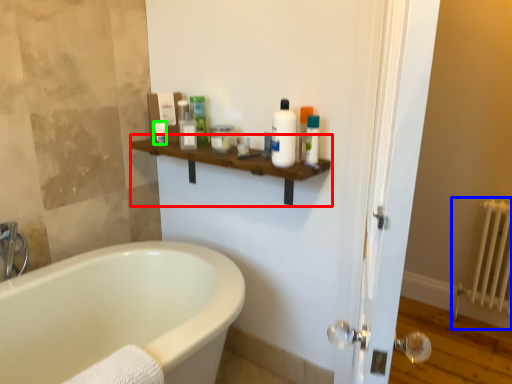
Question: Based on their relative distances, which object is nearer to balustrade (highlighted by a red box)? Choose from radiator (highlighted by a blue box) and toiletry (highlighted by a green box).

Choices:
 (A) radiator
 (B) toiletry

Answer: (B)